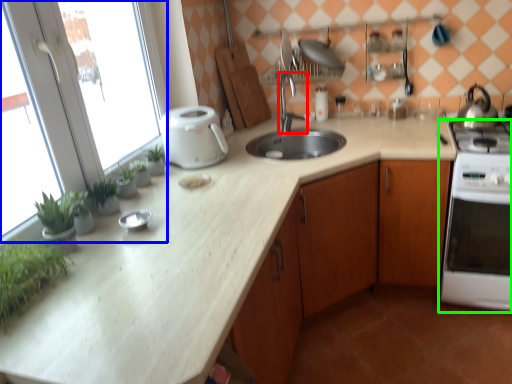
Question: Considering the real-world distances, which object is closest to tap (highlighted by a red box)? window screen (highlighted by a blue box) or home appliance (highlighted by a green box).

Choices:
 (A) window screen
 (B) home appliance

Answer: (B)